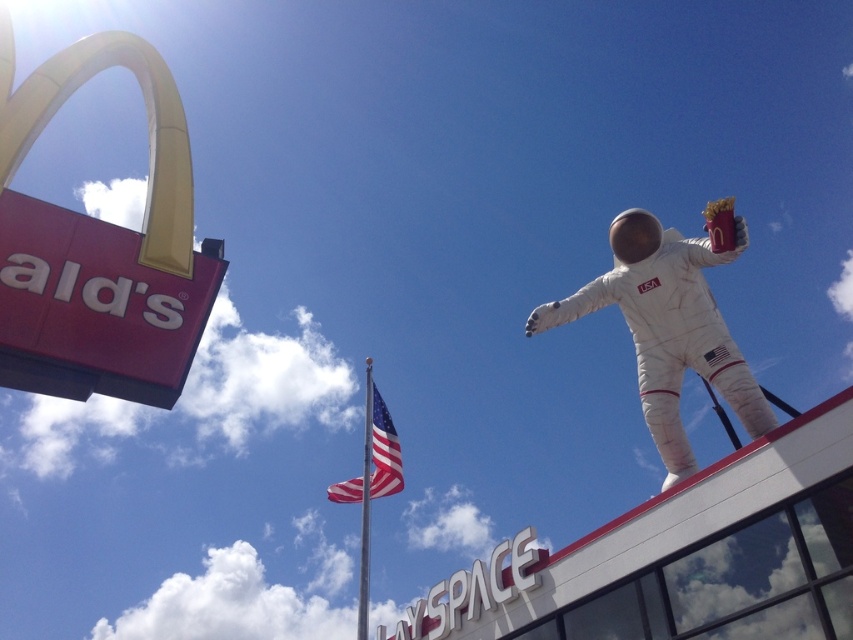
You are a drone operator trying to capture a photo of the white fabric astronaut at upper right. The camera has a crosshair that can be placed at any coordinate between 0 and 1 on both axes. What coordinates should you aim for to center the astronaut?

The white fabric astronaut at upper right is located at coordinates 0.514 on the x axis and 0.784 on the y axis, so you should aim for those coordinates to center the astronaut.